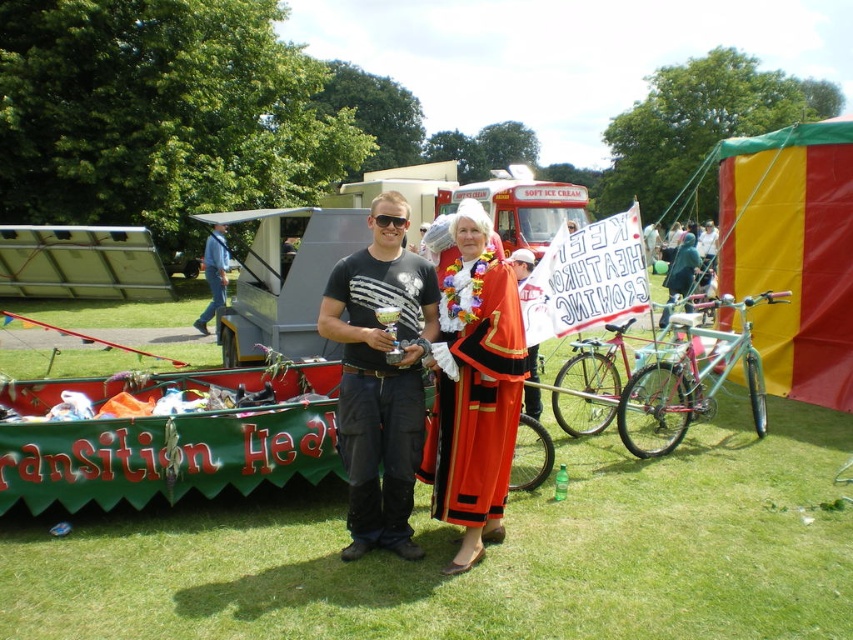
Which is below, matte black t-shirt at center or teal matte bicycle at right?

teal matte bicycle at right

Who is positioned more to the left, matte black t-shirt at center or teal matte bicycle at right?

Positioned to the left is matte black t-shirt at center.

You are a GUI agent. You are given a task and a screenshot of the screen. Output one action in this format:
    pyautogui.click(x=<x>, y=<y>)
    Task: Click on the matte black t-shirt at center
    Image resolution: width=853 pixels, height=640 pixels.
    Given the screenshot: What is the action you would take?
    pyautogui.click(x=412, y=369)

Where is `matte black t-shirt at center`? The width and height of the screenshot is (853, 640). matte black t-shirt at center is located at coordinates (412, 369).

Is orange satin robe at center further to the viewer compared to blue jeans at left?

No.

Is point (495, 413) positioned after point (222, 257)?

No, (495, 413) is closer to viewer.

You are a GUI agent. You are given a task and a screenshot of the screen. Output one action in this format:
    pyautogui.click(x=<x>, y=<y>)
    Task: Click on the orange satin robe at center
    
    Given the screenshot: What is the action you would take?
    pyautogui.click(x=474, y=388)

Can you confirm if matte black t-shirt at center is wider than pink metallic bicycle at center-right?

In fact, matte black t-shirt at center might be narrower than pink metallic bicycle at center-right.

Who is more forward, (416, 340) or (584, 362)?

Point (416, 340)

Where is `matte black t-shirt at center`? The height and width of the screenshot is (640, 853). matte black t-shirt at center is located at coordinates (412, 369).